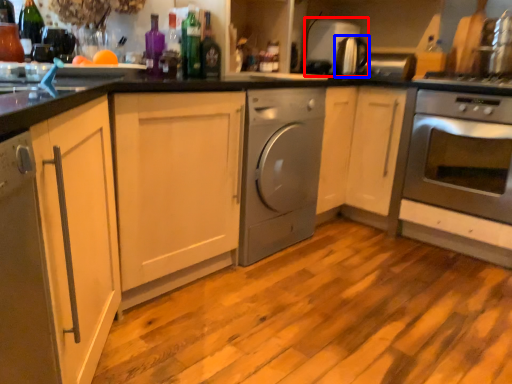
Question: Among these objects, which one is nearest to the camera, appliance (highlighted by a red box) or appliance (highlighted by a blue box)?

Choices:
 (A) appliance
 (B) appliance

Answer: (B)